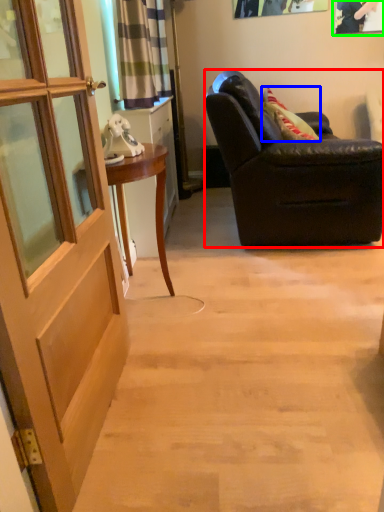
Question: Which object is positioned closest to chair (highlighted by a red box)? Select from pillow (highlighted by a blue box) and picture frame (highlighted by a green box).

Choices:
 (A) pillow
 (B) picture frame

Answer: (A)